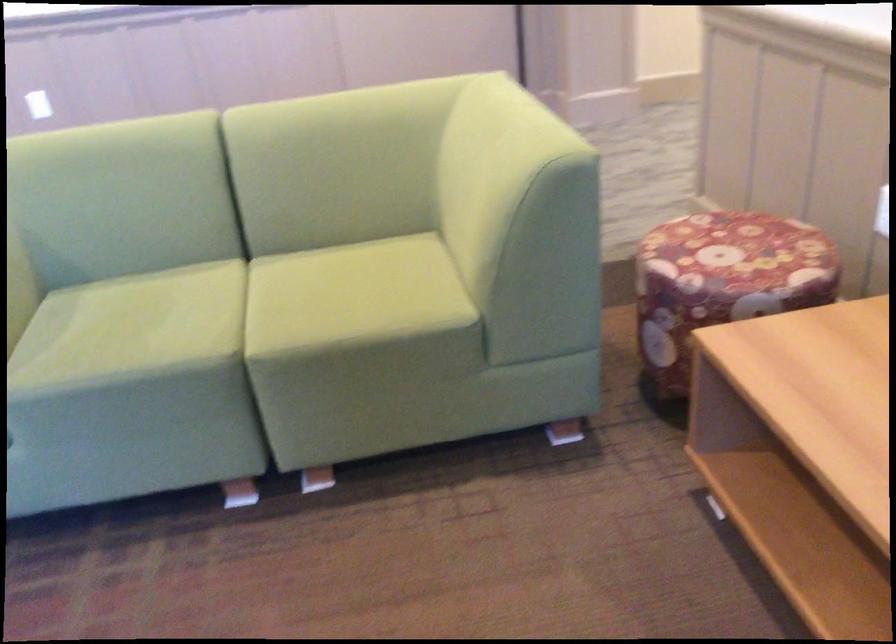
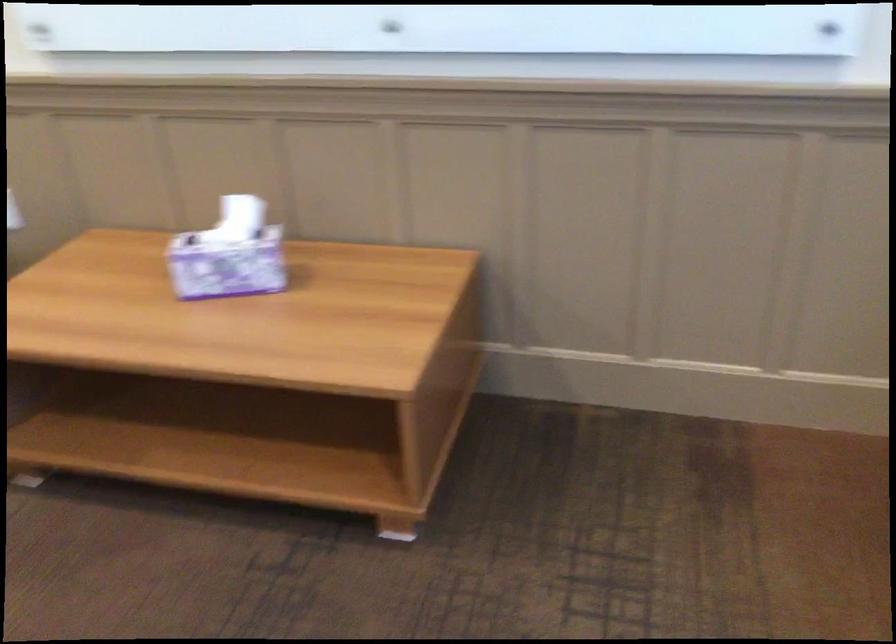
Question: The first image is from the beginning of the video and the second image is from the end. How did the camera likely rotate when shooting the video?

Choices:
 (A) Left
 (B) Right
 (C) Up
 (D) Down

Answer: (B)